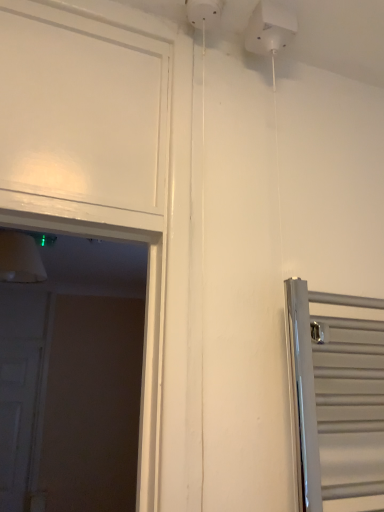
The image size is (384, 512). What do you see at coordinates (17, 421) in the screenshot?
I see `white matte door at left` at bounding box center [17, 421].

Measure the distance between white matte door at left and camera.

white matte door at left is 9.59 feet away from camera.

The height and width of the screenshot is (512, 384). What are the coordinates of `white matte door at left` in the screenshot? It's located at (x=17, y=421).

Locate an element on the screen. white matte door at left is located at coordinates (17, 421).